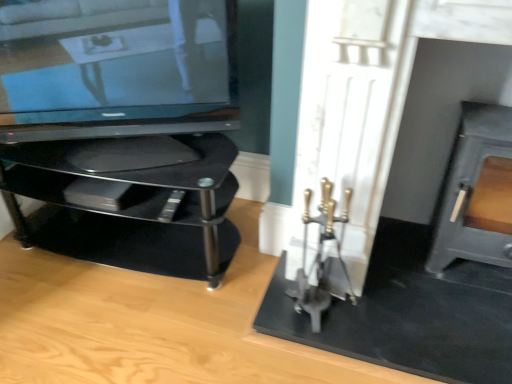
At what (x,y) coordinates should I click in order to perform the action: click on matte gray fireplace at right. Please return your answer as a coordinate pair (x, y). Looking at the image, I should click on (477, 192).

Where is `black glass tv stand at left`? black glass tv stand at left is located at coordinates (132, 210).

Find the location of a particular element. The width and height of the screenshot is (512, 384). satin black tv at left is located at coordinates (x=111, y=69).

Is matte gray fireplace at right in front of or behind satin black tv at left in the image?

In the image, matte gray fireplace at right appears in front of satin black tv at left.

Considering the sizes of objects matte gray fireplace at right and satin black tv at left in the image provided, who is smaller, matte gray fireplace at right or satin black tv at left?

matte gray fireplace at right is smaller.

How far apart are matte gray fireplace at right and satin black tv at left?

A distance of 3.80 feet exists between matte gray fireplace at right and satin black tv at left.

From the image's perspective, which one is positioned lower, matte gray fireplace at right or satin black tv at left?

matte gray fireplace at right is shown below in the image.

Considering the positions of objects black glass tv stand at left and satin black tv at left in the image provided, who is more to the left, black glass tv stand at left or satin black tv at left?

black glass tv stand at left is more to the left.

Can you confirm if black glass tv stand at left is smaller than satin black tv at left?

No.

At what (x,y) coordinates should I click in order to perform the action: click on television above the black glass tv stand at left (from the image's perspective). Please return your answer as a coordinate pair (x, y). Looking at the image, I should click on (111, 69).

Does satin black tv at left have a larger size compared to black glass tv stand at left?

Actually, satin black tv at left might be smaller than black glass tv stand at left.

Which of these two, satin black tv at left or black glass tv stand at left, is thinner?

Thinner between the two is satin black tv at left.

Is matte gray fireplace at right positioned beyond the bounds of black glass tv stand at left?

Yes.

Who is bigger, matte gray fireplace at right or black glass tv stand at left?

With larger size is black glass tv stand at left.

From a real-world perspective, does matte gray fireplace at right sit lower than black glass tv stand at left?

Incorrect, from a real-world perspective, matte gray fireplace at right is higher than black glass tv stand at left.

In the scene shown: Between satin black tv at left and matte gray fireplace at right, which one appears on the left side from the viewer's perspective?

From the viewer's perspective, satin black tv at left appears more on the left side.

Looking at this image, does satin black tv at left turn towards matte gray fireplace at right?

No, satin black tv at left is not aimed at matte gray fireplace at right.

What's the angular difference between satin black tv at left and matte gray fireplace at right's facing directions?

The facing directions of satin black tv at left and matte gray fireplace at right are 23.9 degrees apart.

From the image's perspective, is satin black tv at left over matte gray fireplace at right?

Correct, satin black tv at left appears higher than matte gray fireplace at right in the image.

Is black glass tv stand at left spatially inside matte gray fireplace at right, or outside of it?

black glass tv stand at left is spatially situated outside matte gray fireplace at right.

Does black glass tv stand at left have a lesser height compared to matte gray fireplace at right?

Indeed, black glass tv stand at left has a lesser height compared to matte gray fireplace at right.

From the image's perspective, between black glass tv stand at left and matte gray fireplace at right, who is located below?

black glass tv stand at left.

Where is `fireplace on the right of satin black tv at left`? This screenshot has width=512, height=384. fireplace on the right of satin black tv at left is located at coordinates (477, 192).

Identify the location of television in front of the black glass tv stand at left. The height and width of the screenshot is (384, 512). (111, 69).

Looking at this image, estimate the real-world distances between objects in this image. Which object is further from satin black tv at left, black glass tv stand at left or matte gray fireplace at right?

matte gray fireplace at right is further to satin black tv at left.

From the image, which object appears to be nearer to matte gray fireplace at right, black glass tv stand at left or satin black tv at left?

black glass tv stand at left.

Based on the photo, which object lies nearer to the anchor point black glass tv stand at left, satin black tv at left or matte gray fireplace at right?

satin black tv at left is positioned closer to the anchor black glass tv stand at left.

Considering their positions, is matte gray fireplace at right positioned closer to satin black tv at left than black glass tv stand at left?

Among the two, black glass tv stand at left is located nearer to satin black tv at left.

From the image, which object appears to be farther from black glass tv stand at left, matte gray fireplace at right or satin black tv at left?

matte gray fireplace at right.

Estimate the real-world distances between objects in this image. Which object is closer to matte gray fireplace at right, satin black tv at left or black glass tv stand at left?

black glass tv stand at left lies closer to matte gray fireplace at right than the other object.

The image size is (512, 384). Find the location of `television between black glass tv stand at left and matte gray fireplace at right in the horizontal direction`. television between black glass tv stand at left and matte gray fireplace at right in the horizontal direction is located at coordinates (111, 69).